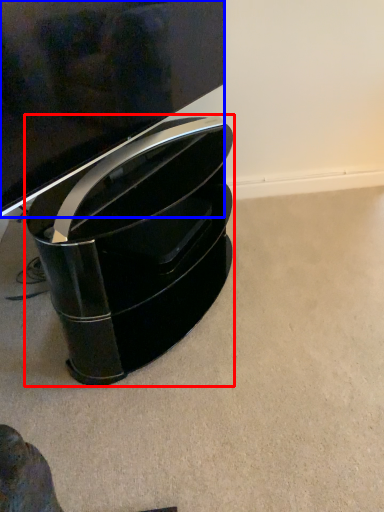
Question: Among these objects, which one is nearest to the camera, furniture (highlighted by a red box) or television (highlighted by a blue box)?

Choices:
 (A) furniture
 (B) television

Answer: (B)